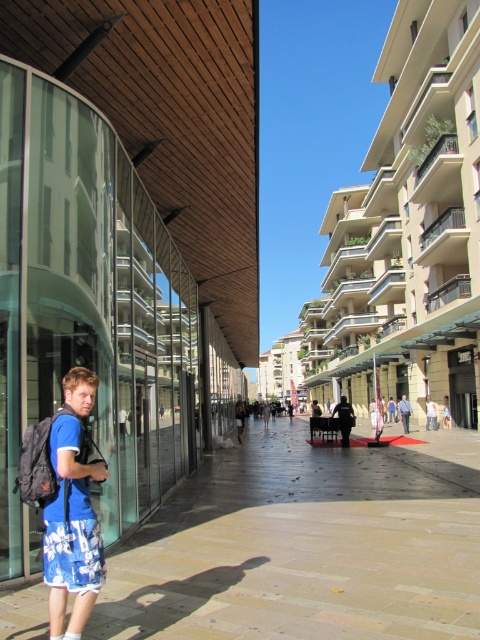
Based on the photo, you are a pedestrian standing on the walkway. You notice the brown stone pavement at lower center and the blue fabric shorts at lower left. Which object is closer to you?

The brown stone pavement at lower center is in front of the blue fabric shorts at lower left, meaning it is closer to you.

You are a fashion designer observing a person in an urban setting. You notice the blue fabric shirt at center and the blue fabric shorts at lower left. Which clothing item appears to have a greater width when viewed from your perspective?

The blue fabric shirt at center might be wider than blue fabric shorts at lower left.

You are a delivery drone flying above the urban scene. You need to land on the brown stone pavement at lower center. What are the coordinates where you should land?

The coordinates for the brown stone pavement at lower center are at point (307, 545).